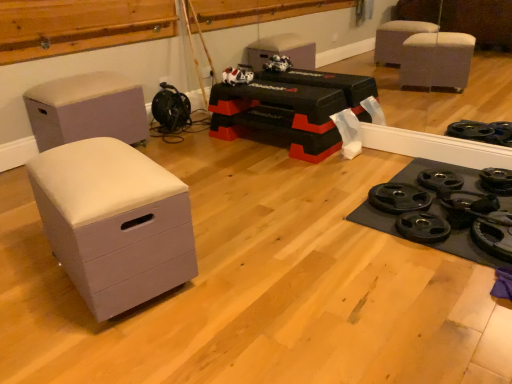
Find the location of `beige fabric ottoman at left`. beige fabric ottoman at left is located at coordinates (86, 109).

This screenshot has width=512, height=384. In order to click on white matte chest of drawers at left in this screenshot , I will do `click(114, 222)`.

Would you say beige fabric ottoman at left is inside or outside white matte chest of drawers at left?

The correct answer is: outside.

Does point (119, 112) come behind point (144, 294)?

Yes, point (119, 112) is behind point (144, 294).

Considering the relative sizes of beige fabric ottoman at left and white matte chest of drawers at left in the image provided, is beige fabric ottoman at left taller than white matte chest of drawers at left?

Yes, beige fabric ottoman at left is taller than white matte chest of drawers at left.

From a real-world perspective, which is physically above, white matte chest of drawers at left or white plush cat at center?

white plush cat at center.

Is point (70, 166) positioned after point (232, 76)?

No, (70, 166) is closer to viewer.

How many degrees apart are the facing directions of white matte chest of drawers at left and white plush cat at center?

9.3 degrees separate the facing orientations of white matte chest of drawers at left and white plush cat at center.

Is black rubber weight plate at lower right aimed at white plush cat at center?

No, black rubber weight plate at lower right is not turned towards white plush cat at center.

Consider the image. From a real-world perspective, which object rests below the other?

black rubber weight plate at lower right, from a real-world perspective.

Does black rubber weight plate at lower right have a larger size compared to white plush cat at center?

No.

Visually, is black rubber weight plate at lower right positioned to the left or to the right of white plush cat at center?

black rubber weight plate at lower right is positioned on white plush cat at center's right side.

Is beige fabric ottoman at left at the back of black rubber weight plate at lower right?

No, black rubber weight plate at lower right is not facing away from beige fabric ottoman at left.

What's the angular difference between black rubber weight plate at lower right and beige fabric ottoman at left's facing directions?

They differ by 97.2 degrees in their facing directions.

From the image's perspective, is black rubber weight plate at lower right positioned above or below beige fabric ottoman at left?

From the image's perspective, black rubber weight plate at lower right appears below beige fabric ottoman at left.

In the image, there is a beige fabric ottoman at left. In order to click on wheel below it (from a real-world perspective) in this screenshot , I will do `click(469, 201)`.

Is white matte chest of drawers at left turned away from black rubber weight plate at lower right?

Correct, white matte chest of drawers at left is looking away from black rubber weight plate at lower right.

Which is further, (109, 226) or (448, 193)?

The point (448, 193) is more distant.

Is white matte chest of drawers at left beside black rubber weight plate at lower right?

They are not placed beside each other.

From a real-world perspective, is white matte chest of drawers at left over black rubber weight plate at lower right?

Correct, in the physical world, white matte chest of drawers at left is higher than black rubber weight plate at lower right.

You are a GUI agent. You are given a task and a screenshot of the screen. Output one action in this format:
    pyautogui.click(x=<x>, y=<y>)
    Task: Click on the furniture lying on the left of black rubber weight plate at lower right
    Image resolution: width=512 pixels, height=384 pixels.
    Given the screenshot: What is the action you would take?
    pyautogui.click(x=86, y=109)

Between point (111, 85) and point (486, 201), which one is positioned behind?

The point (111, 85) is behind.

Consider the image. Is beige fabric ottoman at left oriented towards black rubber weight plate at lower right?

Yes, beige fabric ottoman at left is facing black rubber weight plate at lower right.

How different are the orientations of white plush cat at center and white matte chest of drawers at left in degrees?

They differ by 9.3 degrees in their facing directions.

Which of these two, white plush cat at center or white matte chest of drawers at left, is thinner?

white plush cat at center is thinner.

Considering the positions of objects white plush cat at center and white matte chest of drawers at left in the image provided, who is more to the right, white plush cat at center or white matte chest of drawers at left?

From the viewer's perspective, white plush cat at center appears more on the right side.

Is white plush cat at center not near white matte chest of drawers at left?

That's right, there is a large distance between white plush cat at center and white matte chest of drawers at left.

Where is `the chest of drawers in front of the beige fabric ottoman at left`? the chest of drawers in front of the beige fabric ottoman at left is located at coordinates (114, 222).

Locate an element on the screen. This screenshot has width=512, height=384. chest of drawers below the white plush cat at center (from a real-world perspective) is located at coordinates (114, 222).

Estimate the real-world distances between objects in this image. Which object is closer to black rubber weight plate at lower right, white matte chest of drawers at left or beige fabric ottoman at left?

The object closer to black rubber weight plate at lower right is white matte chest of drawers at left.

Looking at the image, which one is located closer to white plush cat at center, black rubber weight plate at lower right or beige fabric ottoman at left?

Among the two, beige fabric ottoman at left is located nearer to white plush cat at center.

Which object lies further to the anchor point black rubber weight plate at lower right, white plush cat at center or white matte chest of drawers at left?

Based on the image, white plush cat at center appears to be further to black rubber weight plate at lower right.

Estimate the real-world distances between objects in this image. Which object is closer to beige fabric ottoman at left, white matte chest of drawers at left or black rubber weight plate at lower right?

white matte chest of drawers at left is closer to beige fabric ottoman at left.

Looking at the image, which one is located closer to white matte chest of drawers at left, black rubber weight plate at lower right or beige fabric ottoman at left?

Among the two, beige fabric ottoman at left is located nearer to white matte chest of drawers at left.

Looking at this image, considering their positions, is black rubber weight plate at lower right positioned further to white plush cat at center than white matte chest of drawers at left?

white matte chest of drawers at left lies further to white plush cat at center than the other object.

Estimate the real-world distances between objects in this image. Which object is further from white plush cat at center, beige fabric ottoman at left or black rubber weight plate at lower right?

Among the two, black rubber weight plate at lower right is located further to white plush cat at center.

Looking at the image, which one is located closer to beige fabric ottoman at left, black rubber weight plate at lower right or white plush cat at center?

white plush cat at center.

Where is `wheel between white matte chest of drawers at left and white plush cat at center in the front-back direction`? This screenshot has width=512, height=384. wheel between white matte chest of drawers at left and white plush cat at center in the front-back direction is located at coordinates (469, 201).

At what (x,y) coordinates should I click in order to perform the action: click on toy between beige fabric ottoman at left and black rubber weight plate at lower right. Please return your answer as a coordinate pair (x, y). Image resolution: width=512 pixels, height=384 pixels. Looking at the image, I should click on (237, 76).

At what (x,y) coordinates should I click in order to perform the action: click on the chest of drawers located between beige fabric ottoman at left and black rubber weight plate at lower right in the left-right direction. Please return your answer as a coordinate pair (x, y). The width and height of the screenshot is (512, 384). Looking at the image, I should click on (114, 222).

This screenshot has height=384, width=512. In order to click on furniture between white matte chest of drawers at left and white plush cat at center along the z-axis in this screenshot , I will do `click(86, 109)`.